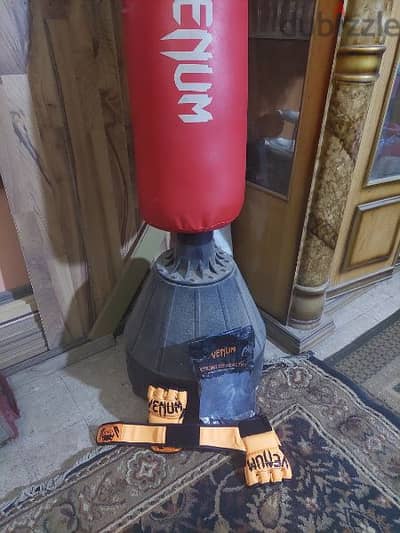
You are a GUI agent. You are given a task and a screenshot of the screen. Output one action in this format:
    pyautogui.click(x=<x>, y=<y>)
    Task: Click on the corner of the right side rug
    
    Given the screenshot: What is the action you would take?
    pyautogui.click(x=326, y=362)